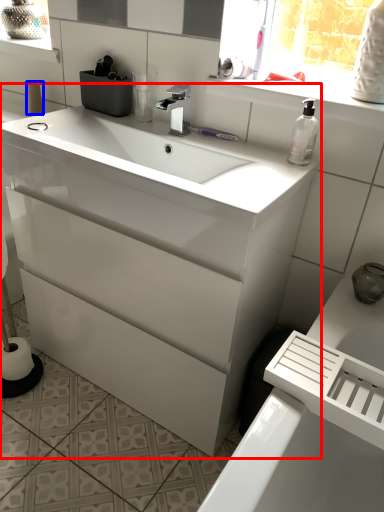
Question: Which object appears farthest to the camera in this image, bathroom cabinet (highlighted by a red box) or toilet paper (highlighted by a blue box)?

Choices:
 (A) bathroom cabinet
 (B) toilet paper

Answer: (B)